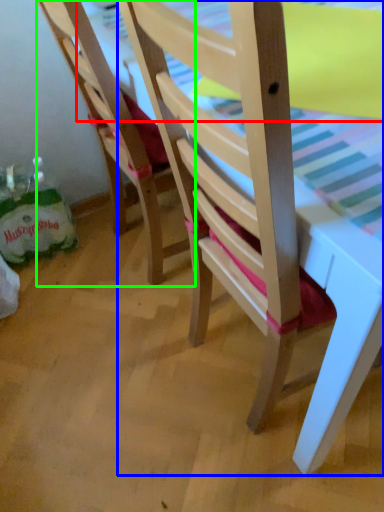
Question: Which object is positioned farthest from table top (highlighted by a red box)? Select from chair (highlighted by a blue box) and chair (highlighted by a green box).

Choices:
 (A) chair
 (B) chair

Answer: (A)